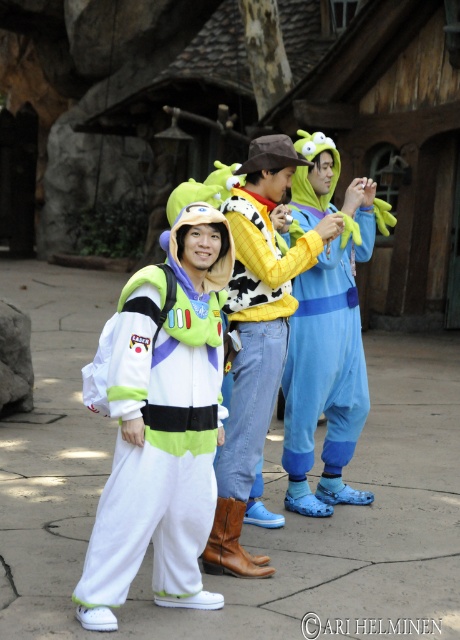
You are standing at the point with coordinates point (172, 275) and want to move towards point (298, 284). Which direction should you walk?

Since point (172, 275) is in front of point (298, 284), you should walk backward to reach point (298, 284) from your current position.

You are a photographer trying to capture a group photo of the white fleece jacket at center and the blue plush onesie at center. Since you want to ensure both are visible in the frame, which object should you position closer to the left side of the camera?

The white fleece jacket at center should be positioned closer to the left side of the camera because it is already to the left of the blue plush onesie at center in the scene.